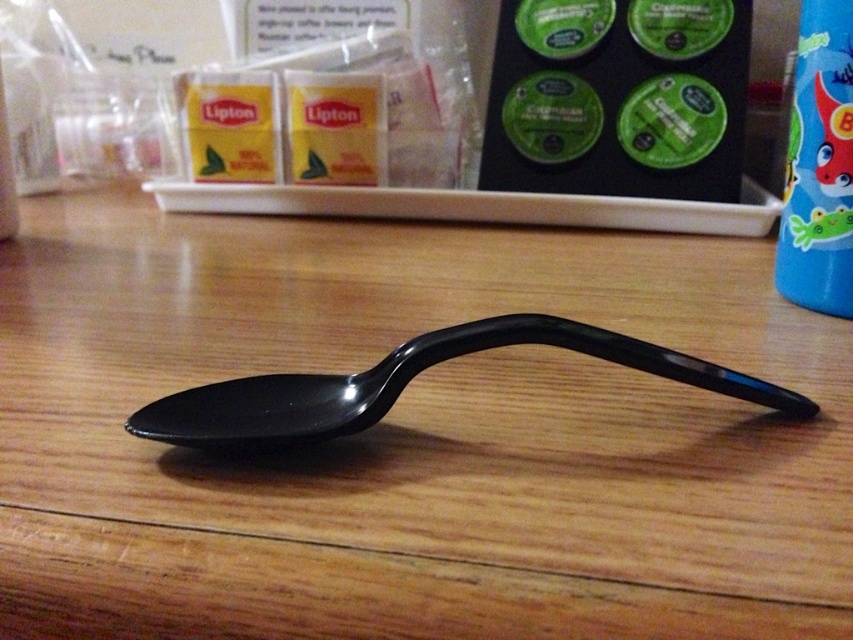
Who is more distant from viewer, (474, 387) or (688, 372)?

Point (474, 387)

Does wooden table at center appear on the left side of black glossy spoon at center?

Incorrect, wooden table at center is not on the left side of black glossy spoon at center.

Measure the distance between point (718, 308) and camera.

A distance of 3.29 feet exists between point (718, 308) and camera.

You are a GUI agent. You are given a task and a screenshot of the screen. Output one action in this format:
    pyautogui.click(x=<x>, y=<y>)
    Task: Click on the wooden table at center
    
    Given the screenshot: What is the action you would take?
    pyautogui.click(x=410, y=436)

Between point (228, 394) and point (804, 45), which one is positioned behind?

The point (804, 45) is more distant.

Locate an element on the screen. The image size is (853, 640). black glossy spoon at center is located at coordinates (408, 381).

Is wooden table at center shorter than blue glossy bottle at right?

No, wooden table at center is not shorter than blue glossy bottle at right.

Which of these two, wooden table at center or blue glossy bottle at right, stands taller?

wooden table at center

Does point (347, 541) come farther from viewer compared to point (786, 224)?

No, it is not.

In order to click on wooden table at center in this screenshot , I will do `click(410, 436)`.